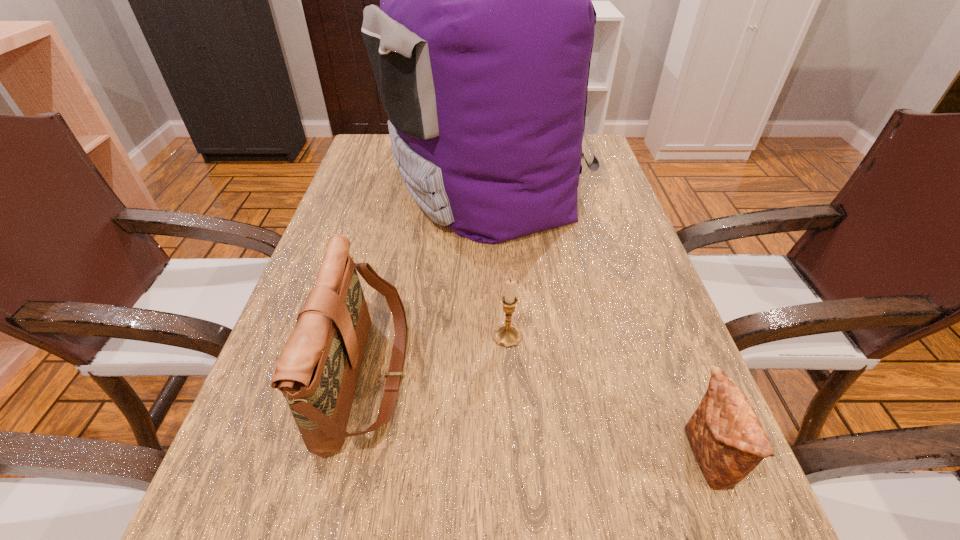
Identify the location of object that is the closest one to the tallest object. This screenshot has width=960, height=540. (317, 372).

Select which object is the third closest to the candle holder. Please provide its 2D coordinates. Your answer should be formatted as a tuple, i.e. [(x, y)], where the tuple contains the x and y coordinates of a point satisfying the conditions above.

[(728, 441)]

The width and height of the screenshot is (960, 540). Find the location of `vacant space that satisfies the following two spatial constraints: 1. on the front side of the candle holder; 2. on the front-facing side of the third shortest object`. vacant space that satisfies the following two spatial constraints: 1. on the front side of the candle holder; 2. on the front-facing side of the third shortest object is located at coordinates (510, 376).